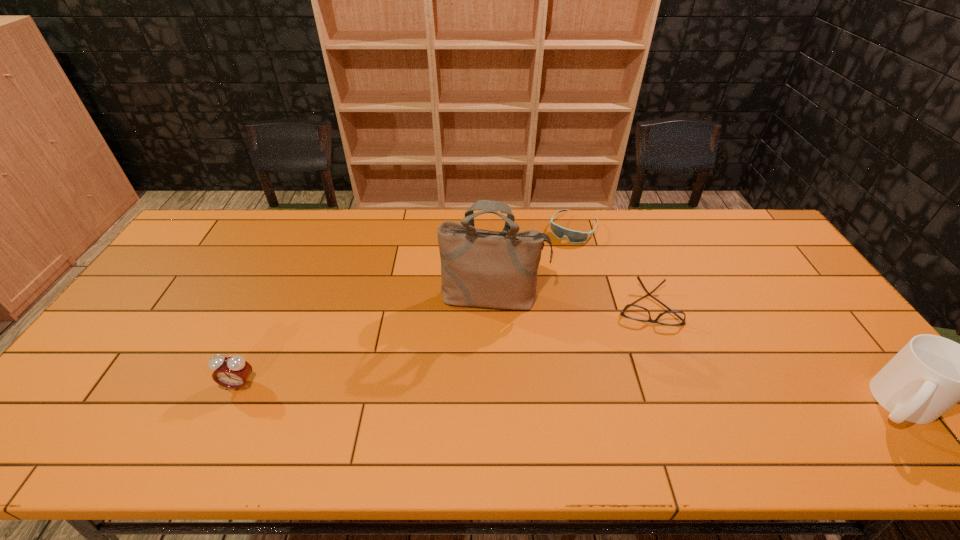
You are a GUI agent. You are given a task and a screenshot of the screen. Output one action in this format:
    pyautogui.click(x=<x>, y=<y>)
    Task: Click on the free space on the desktop that is between the third shortest object and the rightmost object and is positioned on the front-facing side of the goggles
    The image size is (960, 540).
    Given the screenshot: What is the action you would take?
    pyautogui.click(x=466, y=391)

Find the location of a particular element. The width and height of the screenshot is (960, 540). vacant spot on the desktop that is between the leftmost object and the rightmost object and is positioned on the front-facing side of the second object from left to right is located at coordinates (489, 392).

Find the location of a particular element. The height and width of the screenshot is (540, 960). free space on the desktop that is between the leftmost object and the rightmost object and is positioned on the front-facing side of the spectacles is located at coordinates (653, 396).